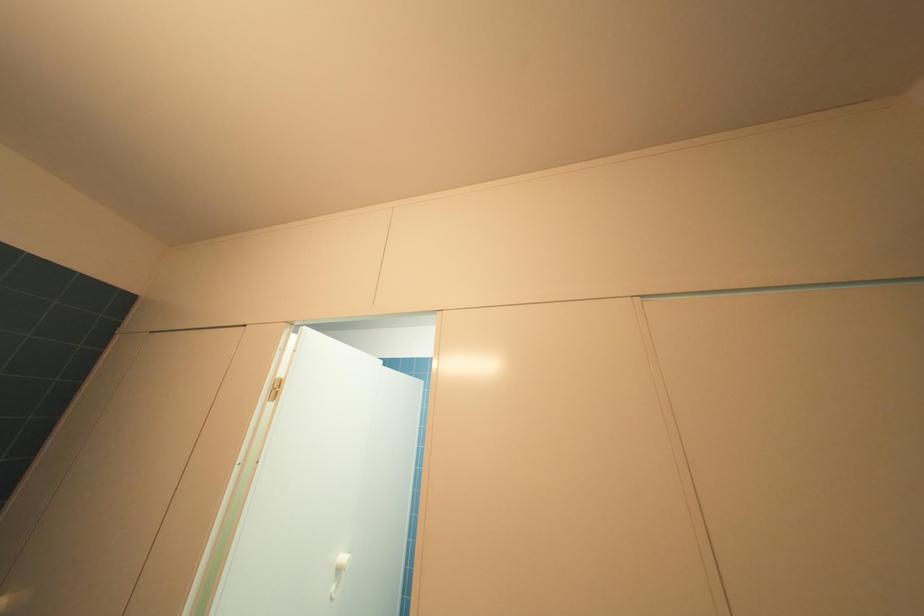
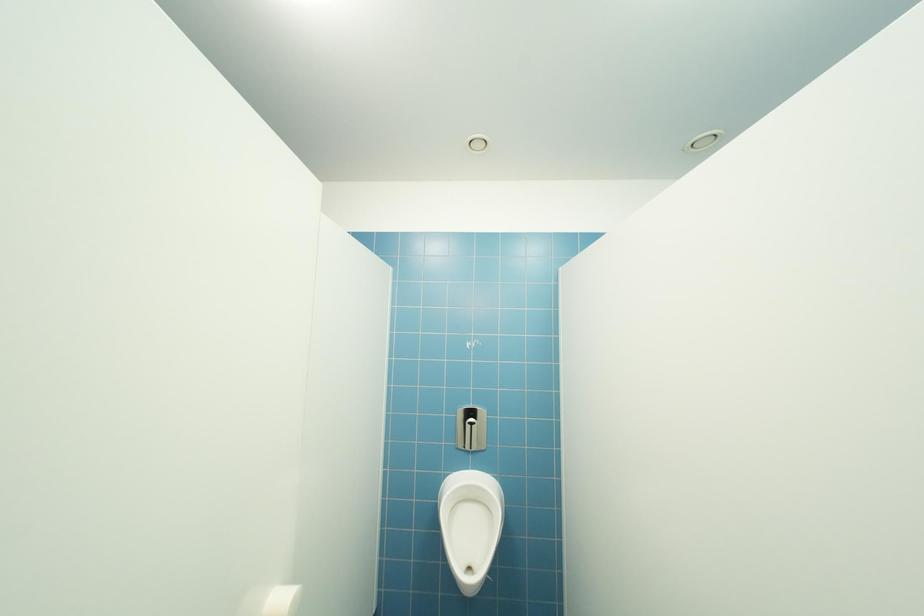
In a continuous first-person perspective shot, in which direction is the camera moving?

The cameraman moved toward left, forward.